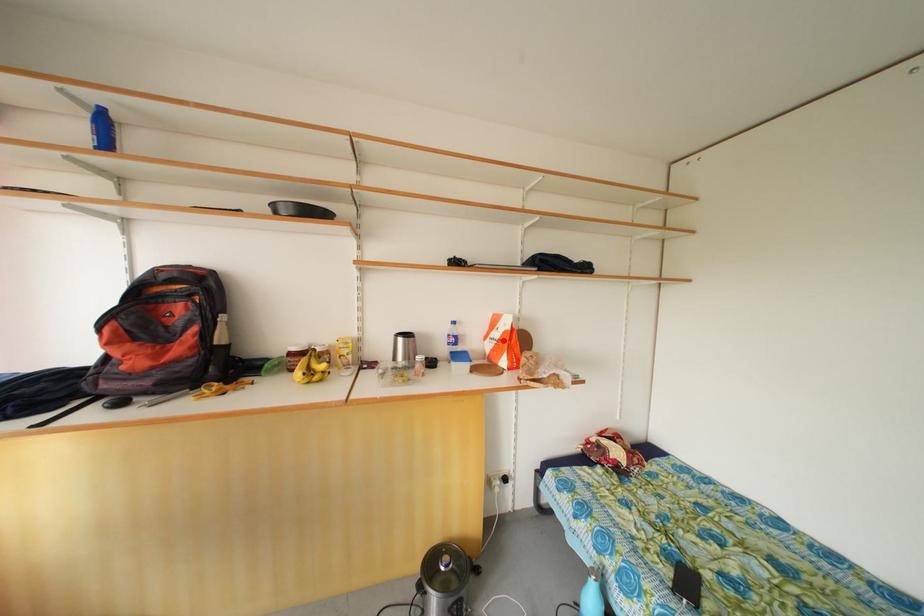
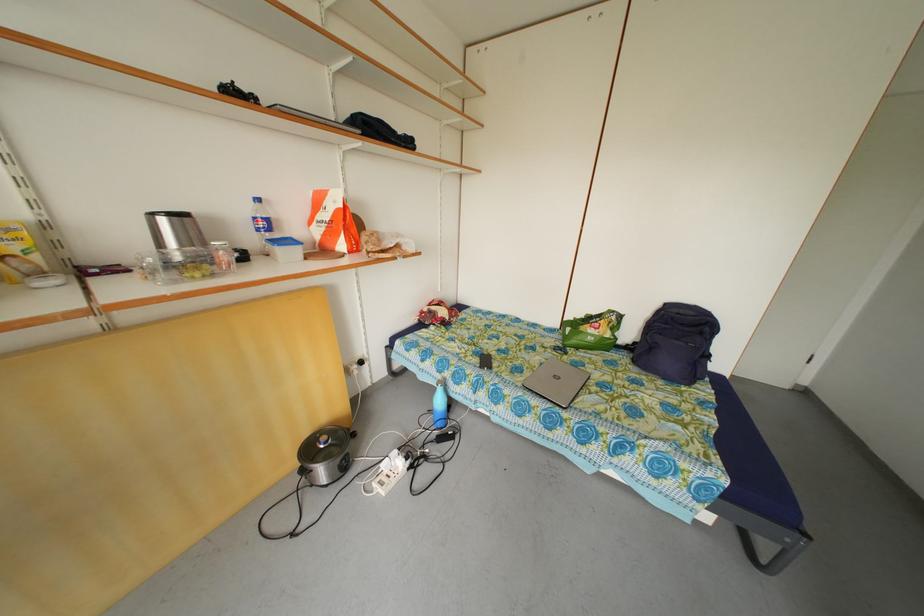
Question: I am providing you with two images of the same scene from different viewpoints. Image1 has a red point marked. In image2, the corresponding 3D location appears at what relative position? Reply with the corresponding letter.

Choices:
 (A) Closer
 (B) Farther

Answer: (A)